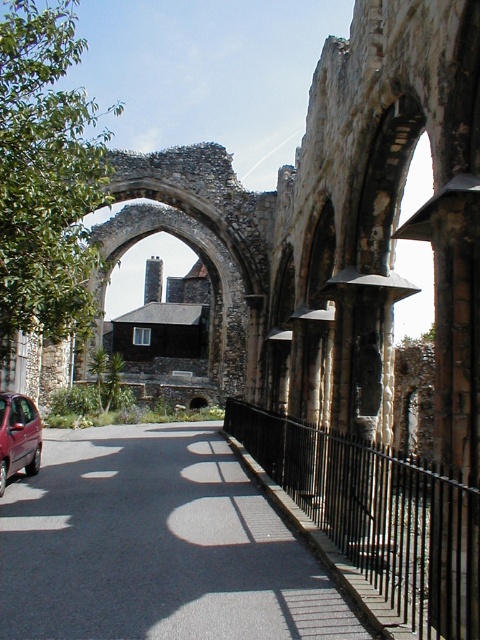
Which is below, black asphalt road at center or metallic maroon car at lower left?

black asphalt road at center

Is point (36, 540) more distant than point (28, 419)?

No, (36, 540) is in front of (28, 419).

The height and width of the screenshot is (640, 480). Identify the location of black asphalt road at center. (156, 545).